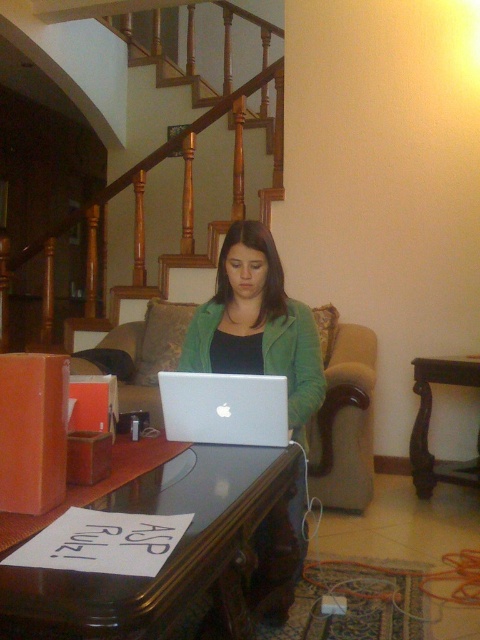
You are helping to rearrange the living room. The wooden at center and the beige fabric couch at center need to be placed side by side. Which object should be placed first to ensure they fit properly?

The wooden at center should be placed first because it is wider than the beige fabric couch at center, ensuring there is enough space for both when placed side by side.

You are a delivery person who just arrived at this address. You see the wooden at center and the matte green jacket at center in the living room. Which object is closer to the front of the room?

The wooden at center is closer to the front of the room because the matte green jacket at center is behind it.

You are a delivery person who just arrived at this address. You see the wooden at center and the matte green jacket at center. Which object is bigger in size?

The wooden at center is larger in size compared to the matte green jacket at center according to the description.